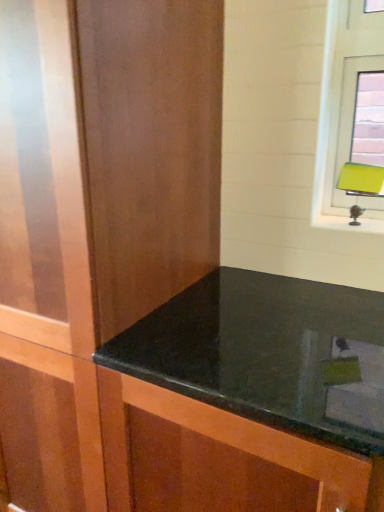
Question: From the image's perspective, is matte wood dresser at center above or below black granite countertop at center?

Choices:
 (A) below
 (B) above

Answer: (B)

Question: Looking at their shapes, would you say matte wood dresser at center is wider or thinner than black granite countertop at center?

Choices:
 (A) thin
 (B) wide

Answer: (A)

Question: Estimate the real-world distances between objects in this image. Which object is farther from the matte wood dresser at center?

Choices:
 (A) black granite countertop at center
 (B) green matte table lamp at upper right

Answer: (B)

Question: Which is farther from the matte wood dresser at center?

Choices:
 (A) black granite countertop at center
 (B) green matte table lamp at upper right

Answer: (B)